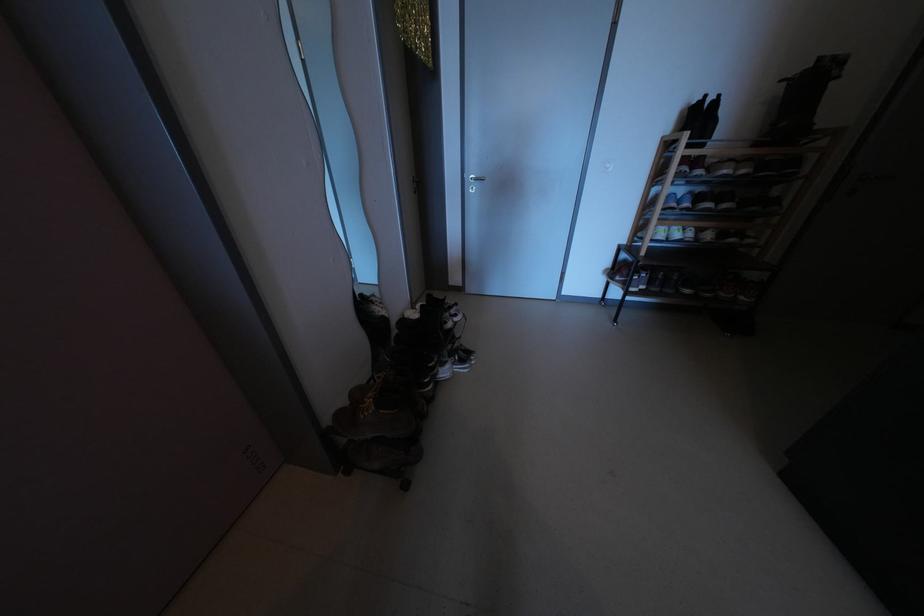
At what (x,y) coordinates should I click in order to perform the action: click on white light switch. Please return your answer as a coordinate pair (x, y). This screenshot has width=924, height=616. Looking at the image, I should click on (606, 166).